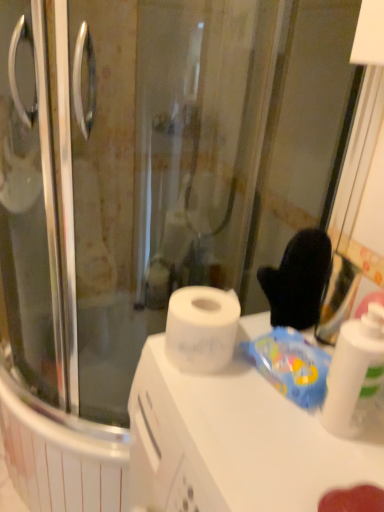
Question: In terms of height, does blue plastic bag at upper right look taller or shorter compared to white matte counter top at center?

Choices:
 (A) short
 (B) tall

Answer: (A)

Question: Considering the positions of blue plastic bag at upper right and white matte counter top at center in the image, is blue plastic bag at upper right bigger or smaller than white matte counter top at center?

Choices:
 (A) small
 (B) big

Answer: (A)

Question: Which object is positioned closest to the white glossy bottle at right?

Choices:
 (A) white matte counter top at center
 (B) blue plastic bag at upper right

Answer: (B)

Question: Which object is positioned farthest from the blue plastic bag at upper right?

Choices:
 (A) white matte counter top at center
 (B) white glossy bottle at right

Answer: (A)